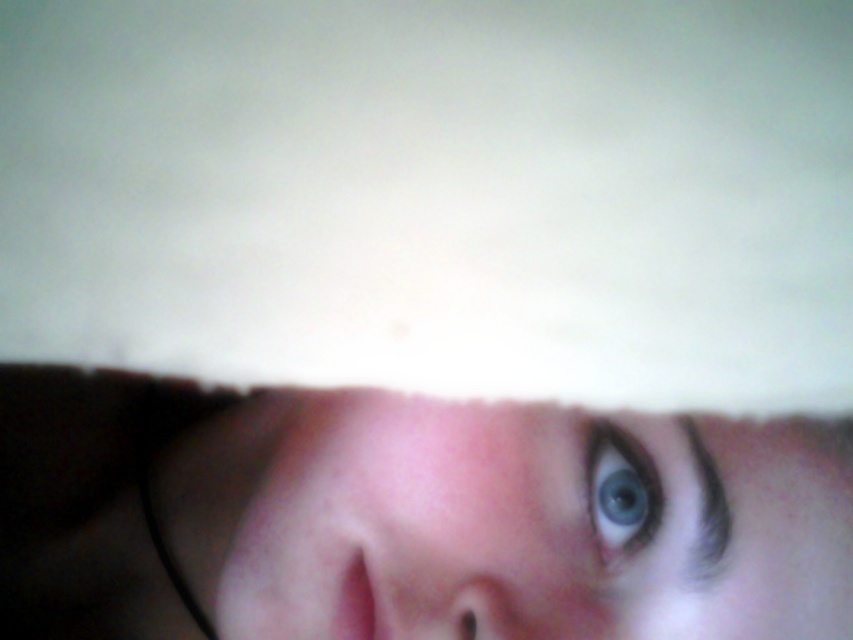
Is smooth skin face at center to the right of blue glossy eye at center from the viewer's perspective?

Incorrect, smooth skin face at center is not on the right side of blue glossy eye at center.

Is point (688, 531) positioned in front of point (628, 524)?

Yes, point (688, 531) is closer to viewer.

Where is `smooth skin face at center`? smooth skin face at center is located at coordinates (x=541, y=528).

Identify the location of smooth skin face at center. Image resolution: width=853 pixels, height=640 pixels. (541, 528).